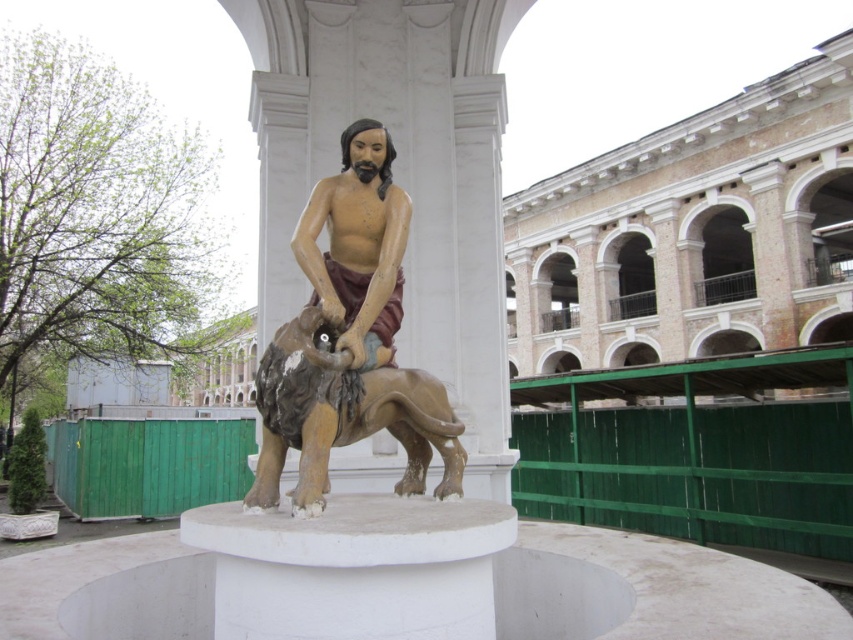
Looking at this image, you are standing in the courtyard and want to take a photo of the wooden statue of man riding animal at center without the matte wood statue at center blocking the view. Is this possible?

The wooden statue of man riding animal at center is positioned under the matte wood statue at center, so you can take a photo of the wooden statue of man riding animal at center from below without the matte wood statue at center blocking the view.

You are standing at the entrance of the courtyard facing the statue. There is a wooden statue of man riding animal at center and a circular pedestal beneath it. If you walk straight towards the statue, will you first reach the statue or the pedestal?

The wooden statue of man riding animal at center is located at point (352,339), so you will first reach the pedestal before the statue as the pedestal is the base supporting the statue and is located directly beneath it.